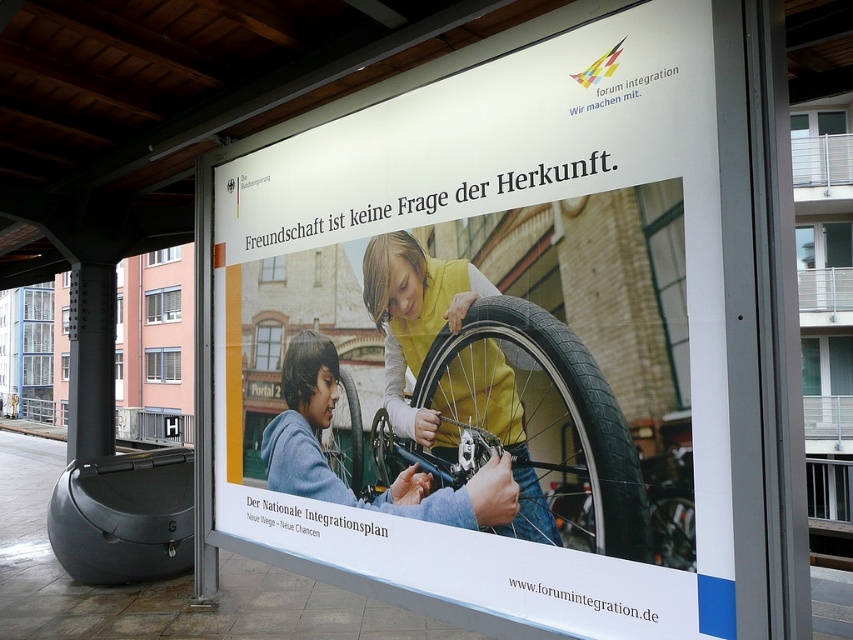
Question: Based on their relative distances, which object is nearer to the white paper poster at center?

Choices:
 (A) blue fleece jacket at center
 (B) rubber/textured tire at center
 (C) metallic silver wheel at center

Answer: (A)

Question: Is white paper poster at center bigger than rubber/textured tire at center?

Choices:
 (A) no
 (B) yes

Answer: (B)

Question: Does blue fleece jacket at center have a larger size compared to rubber/textured tire at center?

Choices:
 (A) no
 (B) yes

Answer: (B)

Question: Among these points, which one is farthest from the camera?

Choices:
 (A) (338, 387)
 (B) (281, 380)
 (C) (523, 390)
 (D) (370, 248)

Answer: (B)

Question: Is white paper poster at center thinner than shiny metallic wheel at center?

Choices:
 (A) no
 (B) yes

Answer: (A)

Question: Which object is closer to the camera taking this photo?

Choices:
 (A) rubber/textured tire at center
 (B) metallic silver wheel at center
 (C) rubber/textured wheel at center
 (D) shiny metallic wheel at center

Answer: (D)